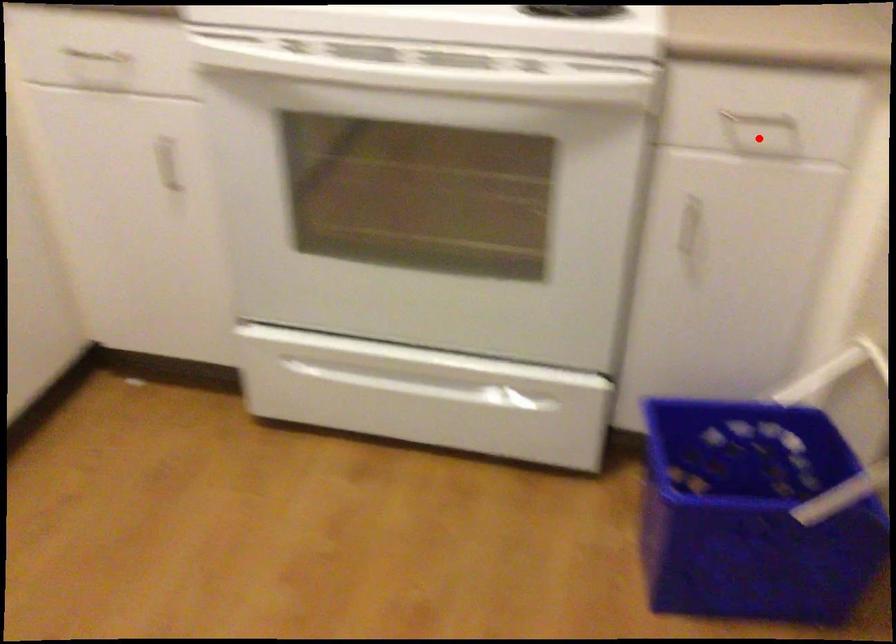
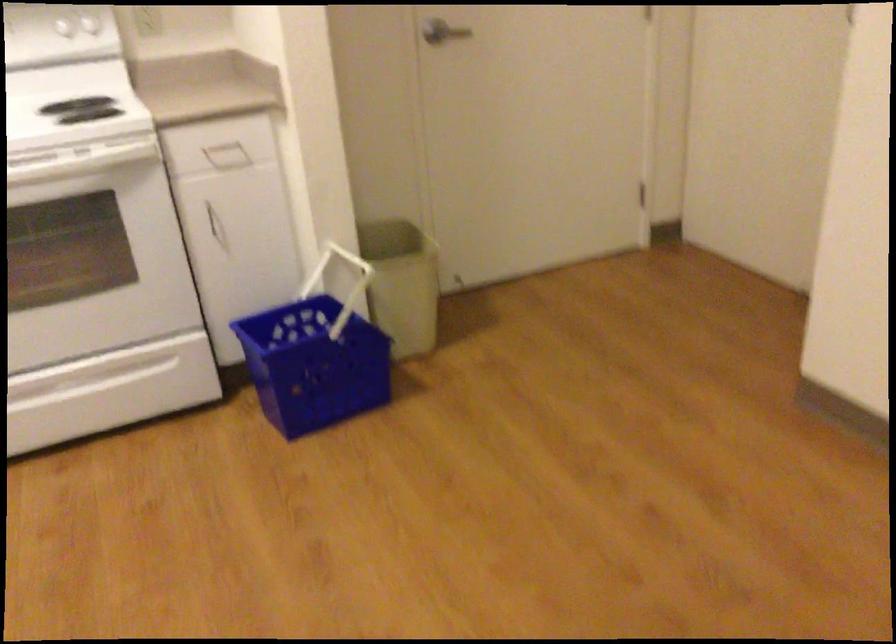
Question: I am providing you with two images of the same scene from different viewpoints. Image1 has a red point marked. In image2, the corresponding 3D location appears at what relative position? Reply with the corresponding letter.

Choices:
 (A) Closer
 (B) Farther

Answer: (B)